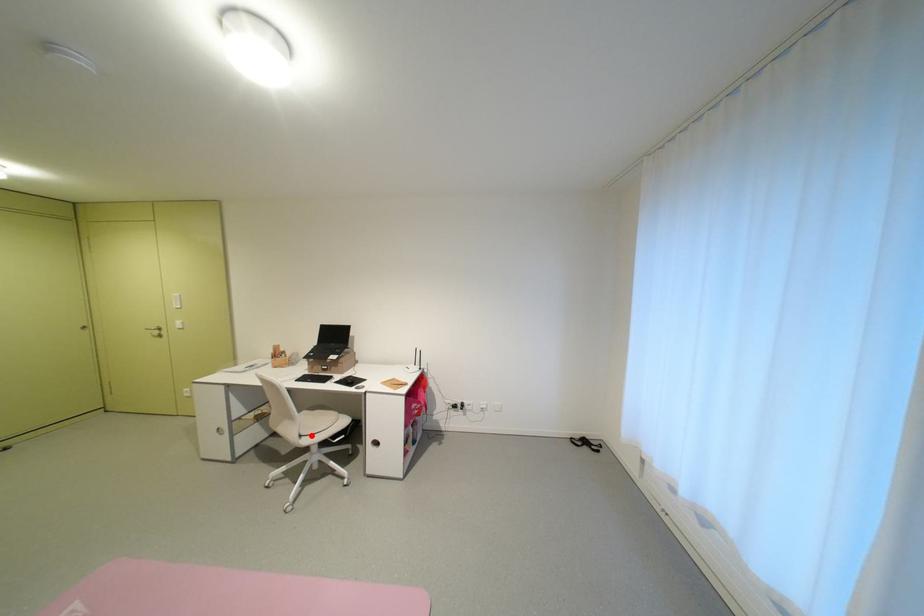
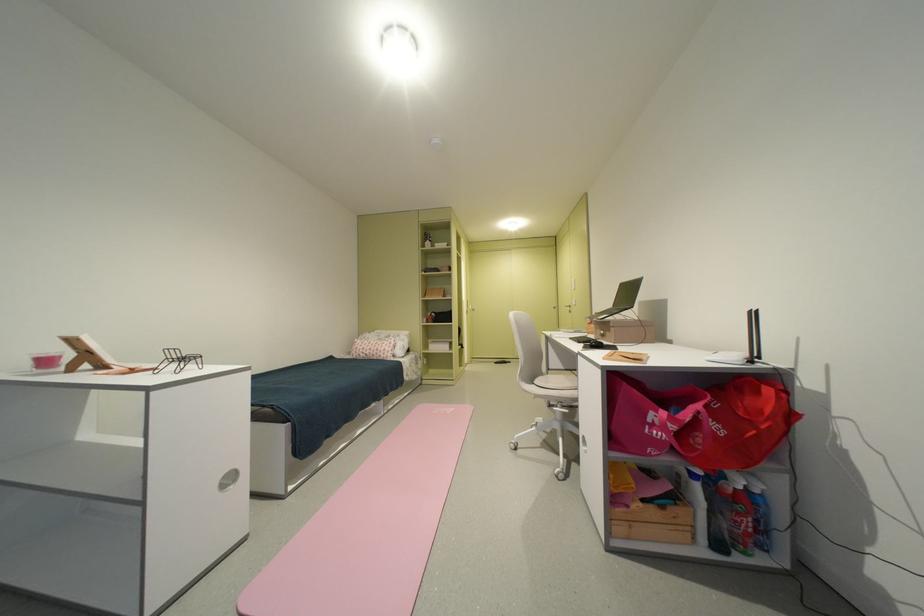
Question: I am providing you with two images of the same scene from different viewpoints. Given a red point in image1, look at the same physical point in image2. Is it:

Choices:
 (A) Closer to the viewpoint
 (B) Farther from the viewpoint

Answer: (B)